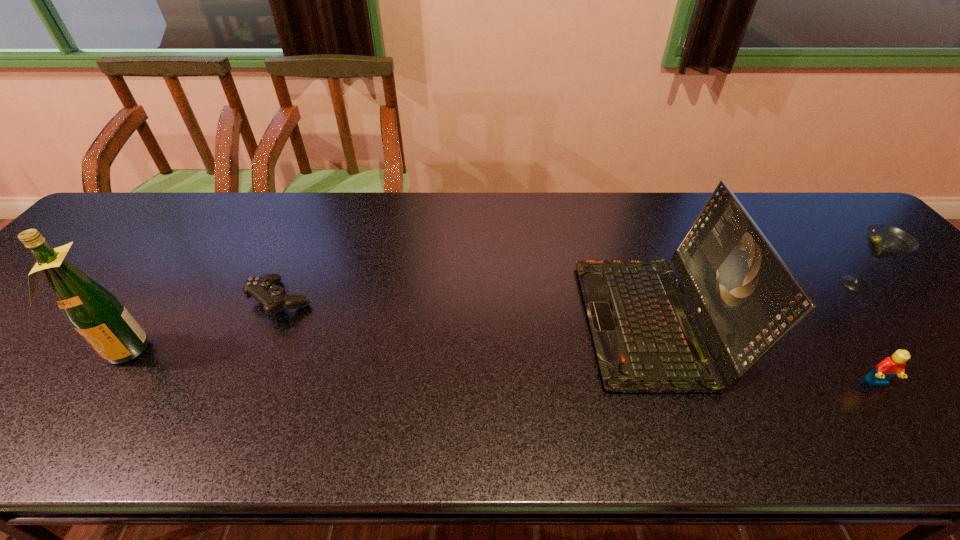
You are a GUI agent. You are given a task and a screenshot of the screen. Output one action in this format:
    pyautogui.click(x=<x>, y=<y>)
    Task: Click on the third closest object relative to the second tallest object
    This screenshot has width=960, height=540.
    Given the screenshot: What is the action you would take?
    pyautogui.click(x=264, y=289)

Locate an element on the screen. free spot that satisfies the following two spatial constraints: 1. on the screen of the fourth shortest object; 2. on the front-facing side of the leftmost object is located at coordinates (661, 352).